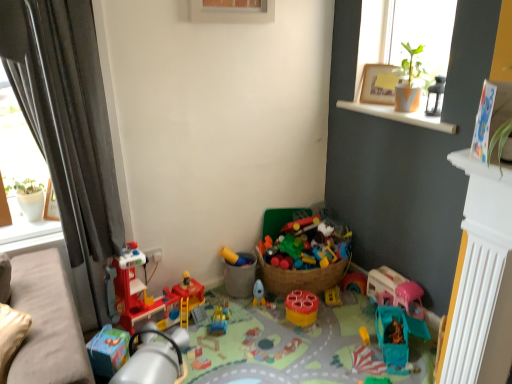
Question: From the image's perspective, would you say beige fabric couch at lower left is shown under white wood window sill at upper right?

Choices:
 (A) yes
 (B) no

Answer: (A)

Question: Is beige fabric couch at lower left facing towards white wood window sill at upper right?

Choices:
 (A) no
 (B) yes

Answer: (A)

Question: Is beige fabric couch at lower left surrounding white wood window sill at upper right?

Choices:
 (A) no
 (B) yes

Answer: (A)

Question: Is beige fabric couch at lower left shorter than white wood window sill at upper right?

Choices:
 (A) no
 (B) yes

Answer: (A)

Question: Is beige fabric couch at lower left turned away from white wood window sill at upper right?

Choices:
 (A) no
 (B) yes

Answer: (A)

Question: Considering the positions of matte yellow plastic toy at center, which ranks as the 4th toy in right-to-left order, and pink plastic toy at lower right, the 7th toy from the left, in the image, is matte yellow plastic toy at center, which ranks as the 4th toy in right-to-left order, taller or shorter than pink plastic toy at lower right, the 7th toy from the left,?

Choices:
 (A) tall
 (B) short

Answer: (B)

Question: In terms of size, does matte yellow plastic toy at center, which ranks as the 4th toy in right-to-left order, appear bigger or smaller than pink plastic toy at lower right, positioned as the 1th toy in right-to-left order?

Choices:
 (A) small
 (B) big

Answer: (B)

Question: Is point (224, 266) positioned closer to the camera than point (414, 309)?

Choices:
 (A) farther
 (B) closer

Answer: (A)

Question: Considering the relative positions of matte yellow plastic toy at center, acting as the fourth toy starting from the left, and pink plastic toy at lower right, positioned as the 1th toy in right-to-left order, in the image provided, is matte yellow plastic toy at center, acting as the fourth toy starting from the left, to the left or to the right of pink plastic toy at lower right, positioned as the 1th toy in right-to-left order,?

Choices:
 (A) left
 (B) right

Answer: (A)

Question: Looking at the image, does plastic construction set at center, placed as the 5th toy when sorted from left to right, seem bigger or smaller compared to gray fabric curtain at left?

Choices:
 (A) big
 (B) small

Answer: (B)

Question: Is plastic construction set at center, the third toy when ordered from right to left, to the left or to the right of gray fabric curtain at left in the image?

Choices:
 (A) left
 (B) right

Answer: (B)

Question: Is point (225, 345) positioned closer to the camera than point (45, 134)?

Choices:
 (A) closer
 (B) farther

Answer: (B)

Question: In the image, is plastic construction set at center, placed as the 5th toy when sorted from left to right, positioned in front of or behind gray fabric curtain at left?

Choices:
 (A) front
 (B) behind

Answer: (B)

Question: From their relative heights in the image, would you say white plastic radiator at lower right is taller or shorter than plastic construction set at center, the third toy when ordered from right to left?

Choices:
 (A) tall
 (B) short

Answer: (A)

Question: Visually, is white plastic radiator at lower right positioned to the left or to the right of plastic construction set at center, placed as the 5th toy when sorted from left to right?

Choices:
 (A) right
 (B) left

Answer: (A)